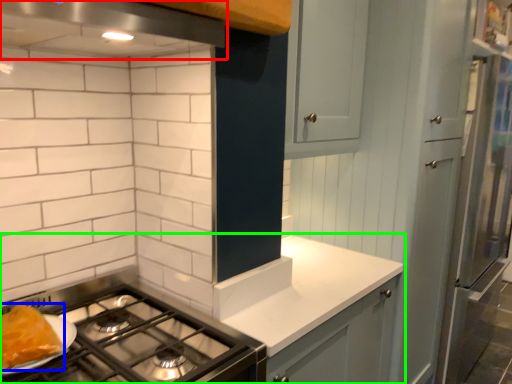
Question: Estimate the real-world distances between objects in this image. Which object is closer to exhaust hood (highlighted by a red box), food (highlighted by a blue box) or countertop (highlighted by a green box)?

Choices:
 (A) food
 (B) countertop

Answer: (A)